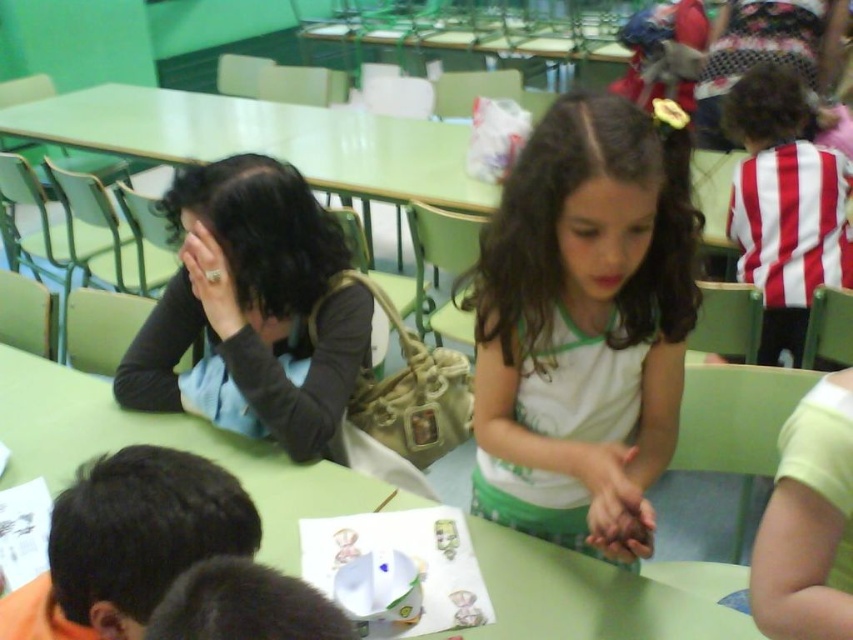
Question: Estimate the real-world distances between objects in this image. Which object is closer to the black matte shirt at left?

Choices:
 (A) green matte table at center
 (B) white matte shirt at center

Answer: (A)

Question: Is white matte shirt at center to the left of dark brown hair at lower left from the viewer's perspective?

Choices:
 (A) no
 (B) yes

Answer: (A)

Question: Which object is the farthest from the green matte table at center?

Choices:
 (A) black matte shirt at left
 (B) white matte shirt at center
 (C) dark brown hair at lower left

Answer: (C)

Question: Considering the relative positions of black matte shirt at left and dark brown hair at lower left in the image provided, where is black matte shirt at left located with respect to dark brown hair at lower left?

Choices:
 (A) above
 (B) below

Answer: (A)

Question: Which object is closer to the camera taking this photo?

Choices:
 (A) green matte table at center
 (B) dark brown hair at lower left
 (C) black matte shirt at left

Answer: (B)

Question: Does black matte shirt at left appear on the right side of dark brown hair at lower left?

Choices:
 (A) no
 (B) yes

Answer: (A)